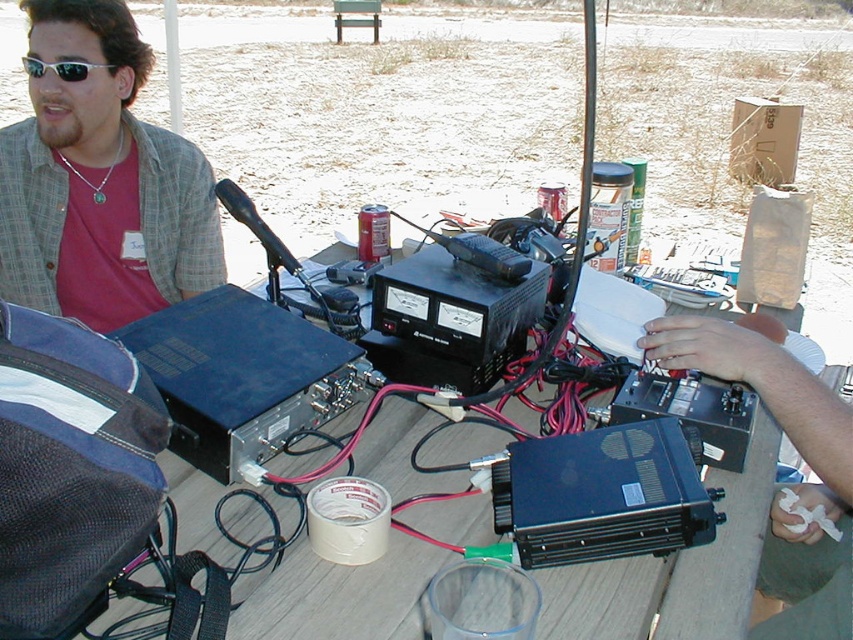
Can you confirm if matte black shirt at left is taller than silver metallic sunglasses at upper left?

Yes, matte black shirt at left is taller than silver metallic sunglasses at upper left.

Is matte black shirt at left above silver metallic sunglasses at upper left?

Incorrect, matte black shirt at left is not positioned above silver metallic sunglasses at upper left.

Looking at this image, measure the distance between matte black shirt at left and camera.

A distance of 1.45 meters exists between matte black shirt at left and camera.

I want to click on matte black shirt at left, so click(x=100, y=180).

Is matte black shirt at left positioned in front of wooden table at center?

No, matte black shirt at left is further to the viewer.

Can you confirm if matte black shirt at left is positioned below wooden table at center?

No.

At what (x,y) coordinates should I click in order to perform the action: click on matte black shirt at left. Please return your answer as a coordinate pair (x, y). Looking at the image, I should click on (100, 180).

Measure the distance between black matte radio at center right and camera.

35.02 inches

Consider the image. Does black matte radio at center right come in front of silver metallic sunglasses at upper left?

Yes, it is.

Does point (753, 625) come behind point (21, 60)?

No, (753, 625) is closer to viewer.

I want to click on black matte radio at center right, so click(x=785, y=484).